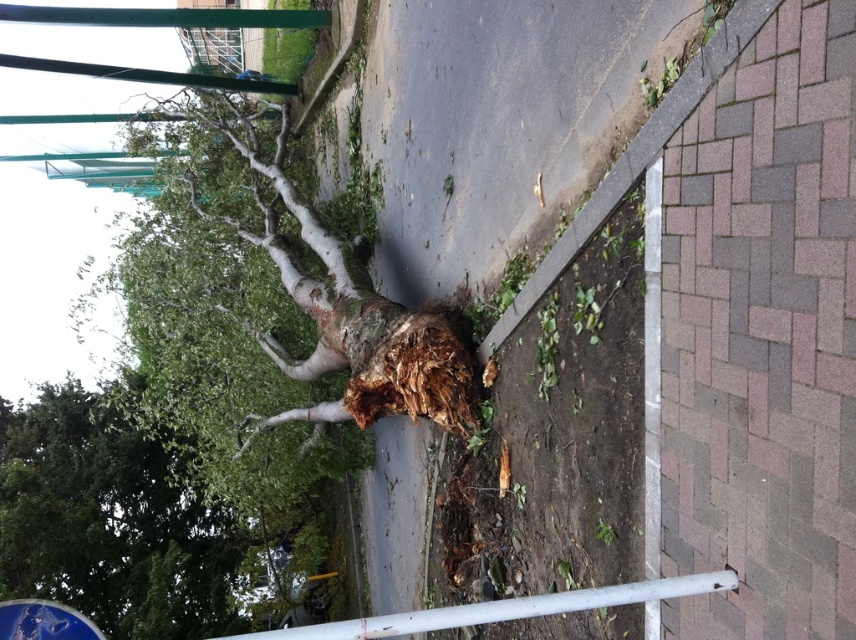
Question: Does green leafy tree at lower left come behind white matte rail at lower center?

Choices:
 (A) no
 (B) yes

Answer: (B)

Question: Estimate the real-world distances between objects in this image. Which object is farther from the white matte rail at lower center?

Choices:
 (A) blue glossy street sign at lower left
 (B) green leafy tree at lower left

Answer: (B)

Question: Which object appears closest to the camera in this image?

Choices:
 (A) green leafy tree at lower left
 (B) white matte rail at lower center

Answer: (B)

Question: Can you confirm if green leafy tree at lower left is wider than blue glossy street sign at lower left?

Choices:
 (A) no
 (B) yes

Answer: (B)

Question: Is green leafy tree at lower left positioned in front of white matte rail at lower center?

Choices:
 (A) no
 (B) yes

Answer: (A)

Question: Among these objects, which one is nearest to the camera?

Choices:
 (A) blue glossy street sign at lower left
 (B) white matte rail at lower center
 (C) green leafy tree at lower left

Answer: (B)